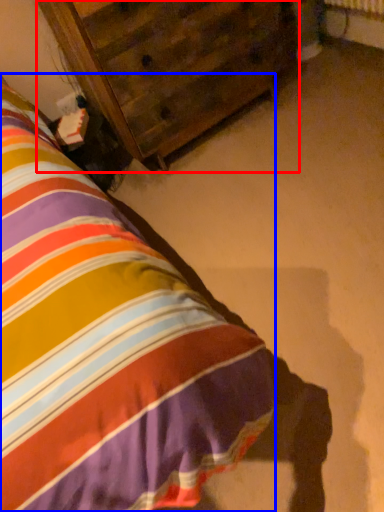
Question: Among these objects, which one is nearest to the camera, furniture (highlighted by a red box) or nightstand (highlighted by a blue box)?

Choices:
 (A) furniture
 (B) nightstand

Answer: (B)